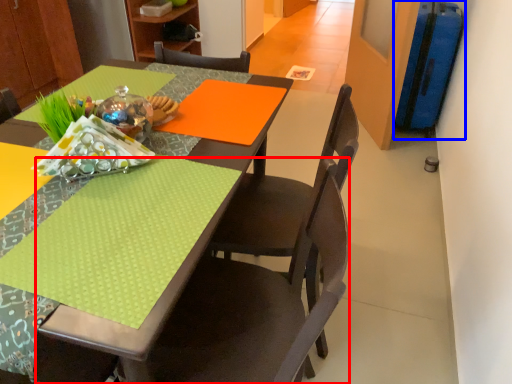
Question: Which point is further to the camera, chair (highlighted by a red box) or luggage (highlighted by a blue box)?

Choices:
 (A) chair
 (B) luggage

Answer: (B)